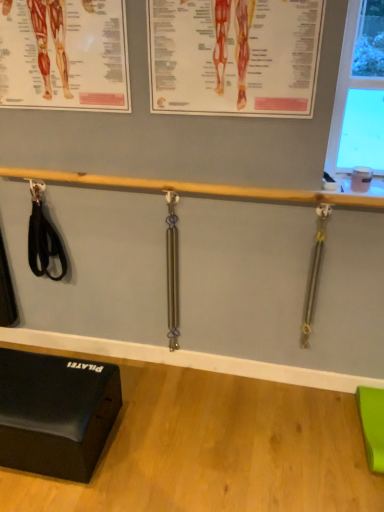
This screenshot has width=384, height=512. In order to click on empty space that is ontop of black rubber exercise block at lower left in this screenshot , I will do `click(41, 387)`.